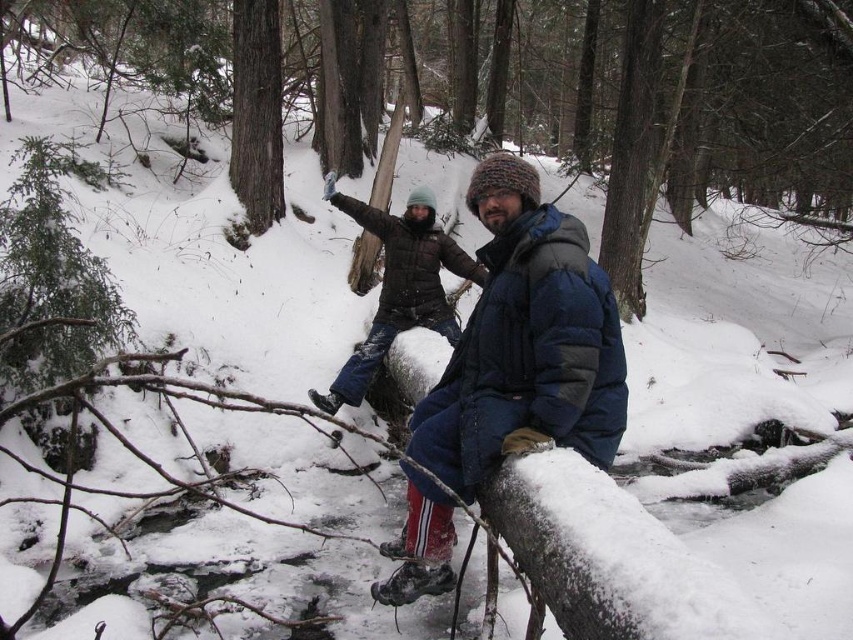
You are standing in the winter forest scene. You see the matte black jacket at center and the smooth brown tree trunk at upper center. Which object is positioned to the right of the other?

The matte black jacket at center is to the right of the smooth brown tree trunk at upper center.

Please provide the coordinates of the blue down jacket at center in the image. The coordinate system is normalized, meaning the top left corner is at point 0,0 and the bottom right corner is at point 1,1. The coordinates are represented as a pair of numbers in the format of x,y. Please answer with the coordinates in the format of x,y. The answer should be a number between 0 and 1 for both x and y.

The coordinates of the blue down jacket at center are (525, 342).